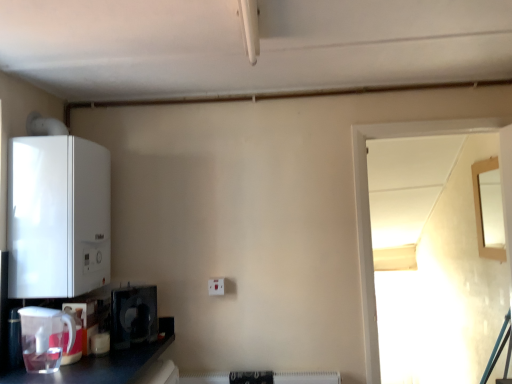
Locate an element on the screen. Image resolution: width=512 pixels, height=384 pixels. vacant area on top of black plastic microwave at lower left, which ranks as the 3th appliance in top-to-bottom order (from a real-world perspective) is located at coordinates (136, 286).